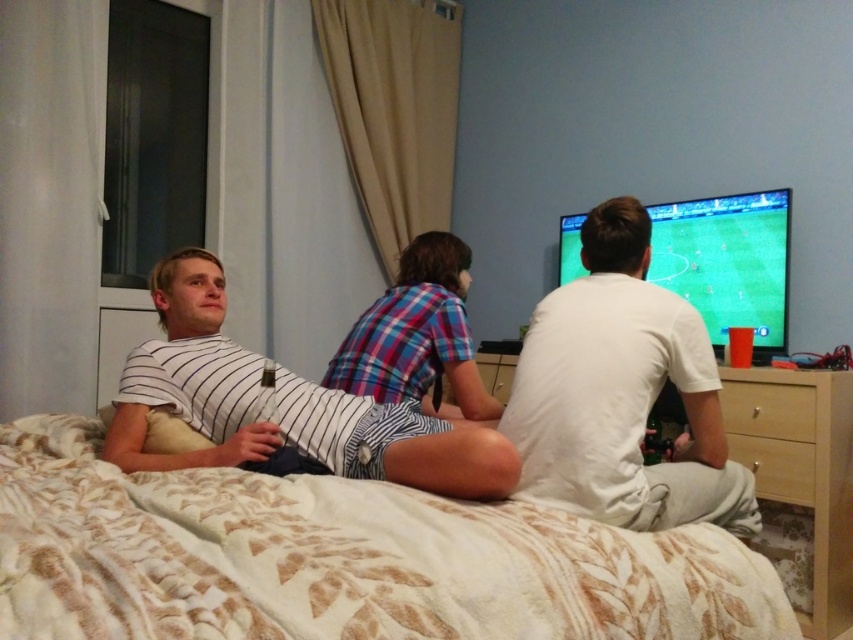
Question: Which point is farther to the camera?

Choices:
 (A) (229, 445)
 (B) (375, 497)
 (C) (567, 323)
 (D) (302, 451)

Answer: (C)

Question: Is white striped shirt at center smaller than white matte shirt at center?

Choices:
 (A) yes
 (B) no

Answer: (B)

Question: Is white textured bed at lower left behind white matte shirt at center?

Choices:
 (A) no
 (B) yes

Answer: (A)

Question: Estimate the real-world distances between objects in this image. Which object is closer to the white striped shirt at left?

Choices:
 (A) white textured bed at lower left
 (B) white striped shirt at center
 (C) white matte shirt at center

Answer: (B)

Question: Which of the following is the closest to the observer?

Choices:
 (A) (200, 570)
 (B) (350, 436)
 (C) (524, 422)

Answer: (A)

Question: Is white textured bed at lower left behind white matte shirt at center?

Choices:
 (A) no
 (B) yes

Answer: (A)